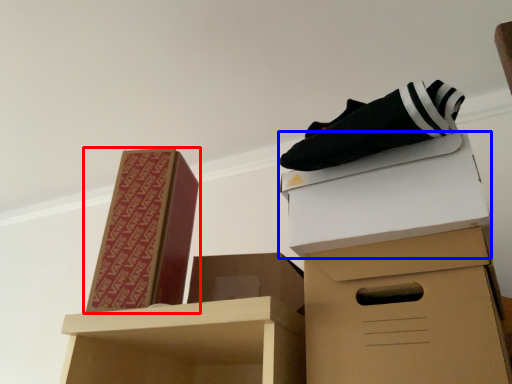
Question: Which object appears closest to the camera in this image, box (highlighted by a red box) or box (highlighted by a blue box)?

Choices:
 (A) box
 (B) box

Answer: (B)